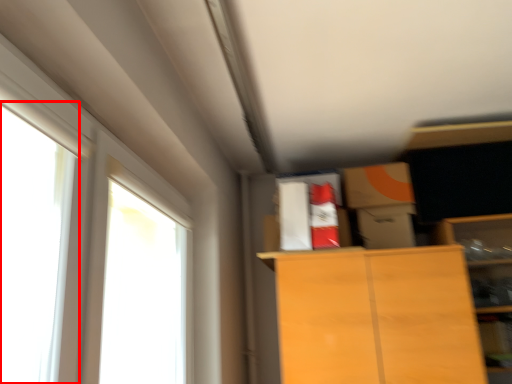
Question: From the image's perspective, what is the correct spatial positioning of window (annotated by the red box) in reference to window?

Choices:
 (A) above
 (B) below

Answer: (A)